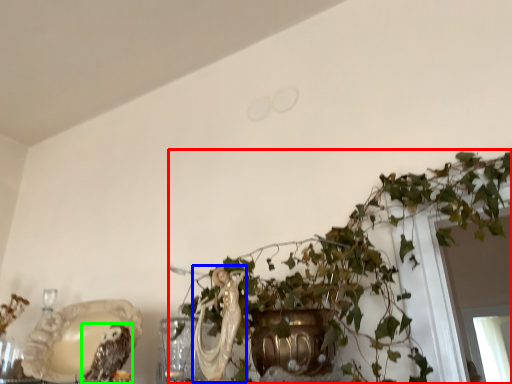
Question: Which object is the farthest from houseplant (highlighted by a red box)? Choose among these: animal (highlighted by a blue box) or owl (highlighted by a green box).

Choices:
 (A) animal
 (B) owl

Answer: (B)